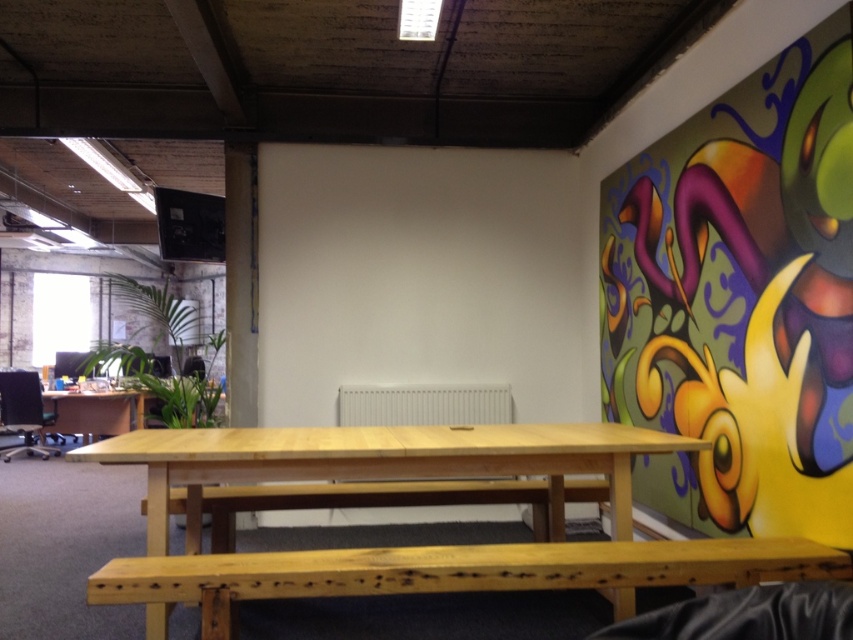
You are organizing a small meeting in the office area and need to seat two people. You have two natural wood benches available. Which bench should you choose if you want to seat more people? The natural wood bench at lower center or the natural wood bench at center?

The natural wood bench at center is larger in size compared to the natural wood bench at lower center, so it can seat more people.

You are organizing a small event and need to place a 2.5 meter long banner between the multicolored painted wall art at right and the natural wood bench at lower center. Is there enough space between them to place the banner horizontally?

The multicolored painted wall art at right is positioned on the right side of the natural wood bench at lower center, so the distance between them is not specified. Without knowing the exact distance, it is impossible to determine if the banner will fit.